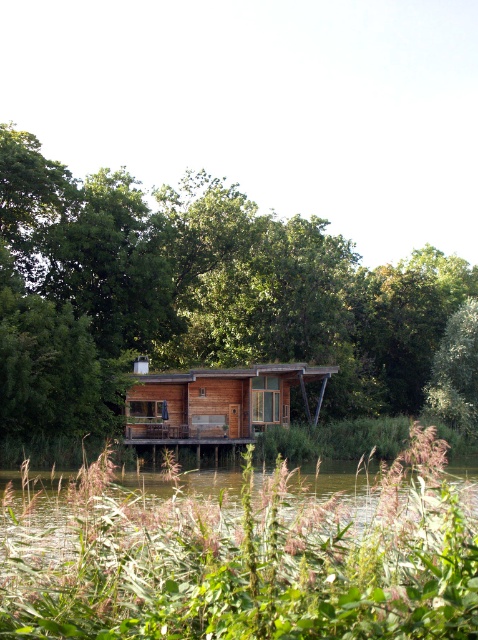
Is point (414, 396) closer to camera compared to point (410, 568)?

No.

Which is more to the left, green wood tree at center or green leafy plants at lower center?

green leafy plants at lower center

You are a GUI agent. You are given a task and a screenshot of the screen. Output one action in this format:
    pyautogui.click(x=<x>, y=<y>)
    Task: Click on the green wood tree at center
    Image resolution: width=478 pixels, height=640 pixels.
    Given the screenshot: What is the action you would take?
    pyautogui.click(x=194, y=296)

Locate an element on the screen. green wood tree at center is located at coordinates (194, 296).

Can you confirm if green leafy plants at lower center is positioned above wooden cabin at center?

No.

Can you confirm if green leafy plants at lower center is wider than wooden cabin at center?

Indeed, green leafy plants at lower center has a greater width compared to wooden cabin at center.

Find the location of a particular element. Image resolution: width=478 pixels, height=640 pixels. green leafy plants at lower center is located at coordinates (259, 564).

Is point (219, 380) behind point (475, 432)?

No.

Can you confirm if wooden cabin at center is thinner than green leafy tree at center-right?

No.

Does point (178, 412) lie behind point (456, 349)?

That is False.

You are a GUI agent. You are given a task and a screenshot of the screen. Output one action in this format:
    pyautogui.click(x=<x>, y=<y>)
    Task: Click on the wooden cabin at center
    This screenshot has width=478, height=640.
    Given the screenshot: What is the action you would take?
    pyautogui.click(x=215, y=403)